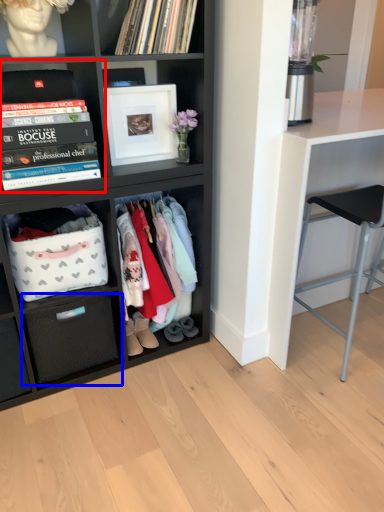
Question: Among these objects, which one is farthest to the camera, shelf (highlighted by a red box) or drawer (highlighted by a blue box)?

Choices:
 (A) shelf
 (B) drawer

Answer: (B)